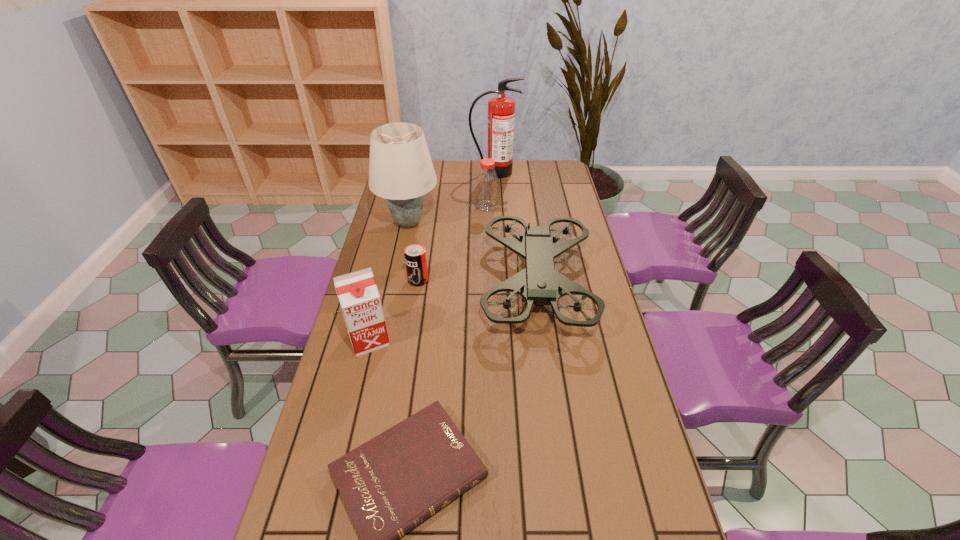
Locate an element on the screen. free space between the third shortest object and the lampshade is located at coordinates [447, 215].

Identify the location of free space between the fifth tallest object and the can. pos(452,243).

Where is `free area in between the can and the drone`? The height and width of the screenshot is (540, 960). free area in between the can and the drone is located at coordinates (477, 281).

Locate an element on the screen. The width and height of the screenshot is (960, 540). empty space between the soya milk and the lampshade is located at coordinates (389, 281).

Identify the location of free space between the drone and the fire extinguisher. (516, 227).

Choose which object is the second nearest neighbor to the drone. Please provide its 2D coordinates. Your answer should be formatted as a tuple, i.e. [(x, y)], where the tuple contains the x and y coordinates of a point satisfying the conditions above.

[(487, 181)]

Select which object appears as the second closest to the lampshade. Please provide its 2D coordinates. Your answer should be formatted as a tuple, i.e. [(x, y)], where the tuple contains the x and y coordinates of a point satisfying the conditions above.

[(539, 283)]

Find the location of `vacant space that satisfies the following two spatial constraints: 1. on the front side of the lampshade; 2. on the left side of the drone`. vacant space that satisfies the following two spatial constraints: 1. on the front side of the lampshade; 2. on the left side of the drone is located at coordinates (396, 283).

The image size is (960, 540). Find the location of `free space that satisfies the following two spatial constraints: 1. on the front-facing side of the drone; 2. on the right side of the farthest object`. free space that satisfies the following two spatial constraints: 1. on the front-facing side of the drone; 2. on the right side of the farthest object is located at coordinates (499, 283).

I want to click on free location that satisfies the following two spatial constraints: 1. on the back side of the soya milk; 2. on the right side of the drone, so click(x=382, y=283).